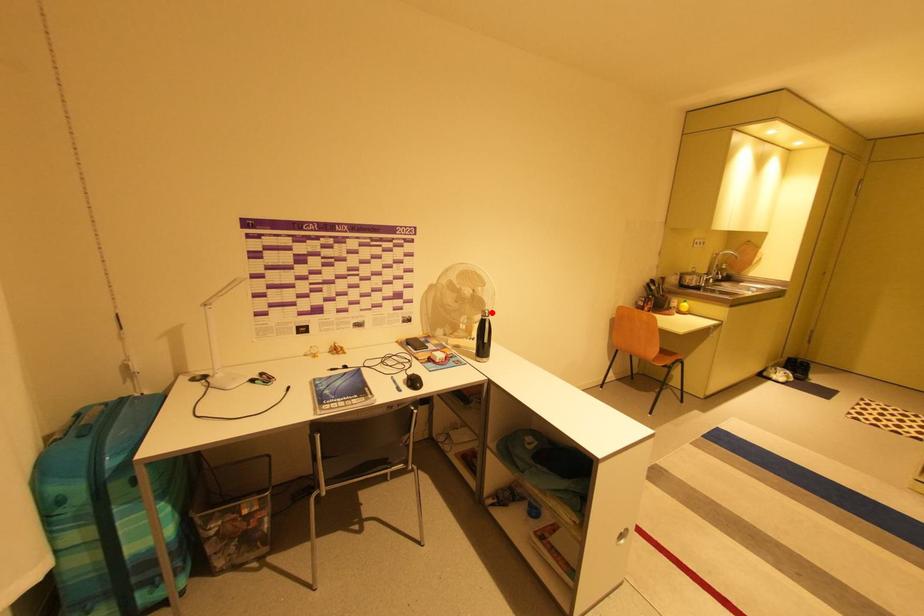
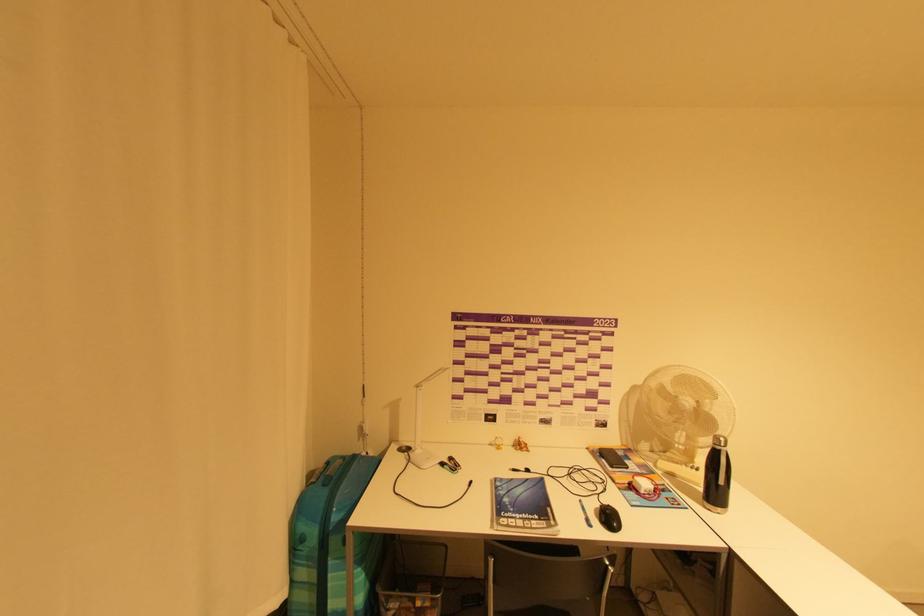
The point at the highlighted location is marked in the first image. Where is the corresponding point in the second image?

(726, 440)